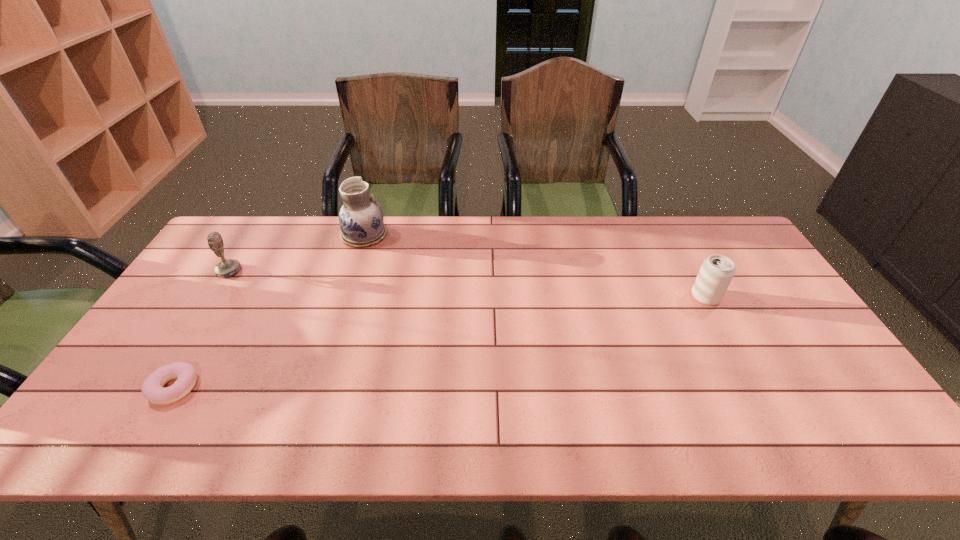
The image size is (960, 540). I want to click on the tallest object, so (361, 222).

Find the location of a particular element. The width and height of the screenshot is (960, 540). the third object from left to right is located at coordinates (361, 222).

Find the location of a particular element. The height and width of the screenshot is (540, 960). microphone is located at coordinates (226, 268).

Locate an element on the screen. Image resolution: width=960 pixels, height=540 pixels. can is located at coordinates (717, 271).

I want to click on the rightmost object, so click(717, 271).

This screenshot has width=960, height=540. Identify the location of the nearest object. (152, 388).

At what (x,y) coordinates should I click in order to perform the action: click on the shortest object. Please return your answer as a coordinate pair (x, y). The width and height of the screenshot is (960, 540). Looking at the image, I should click on (152, 388).

Find the location of a particular element. This screenshot has height=540, width=960. vacant space located 0.350m on the front of the tallest object is located at coordinates (334, 328).

The width and height of the screenshot is (960, 540). In order to click on free location located 0.150m on the front-facing side of the third nearest object in this screenshot , I will do `click(289, 271)`.

Identify the location of free space located on the back of the can. The image size is (960, 540). (661, 217).